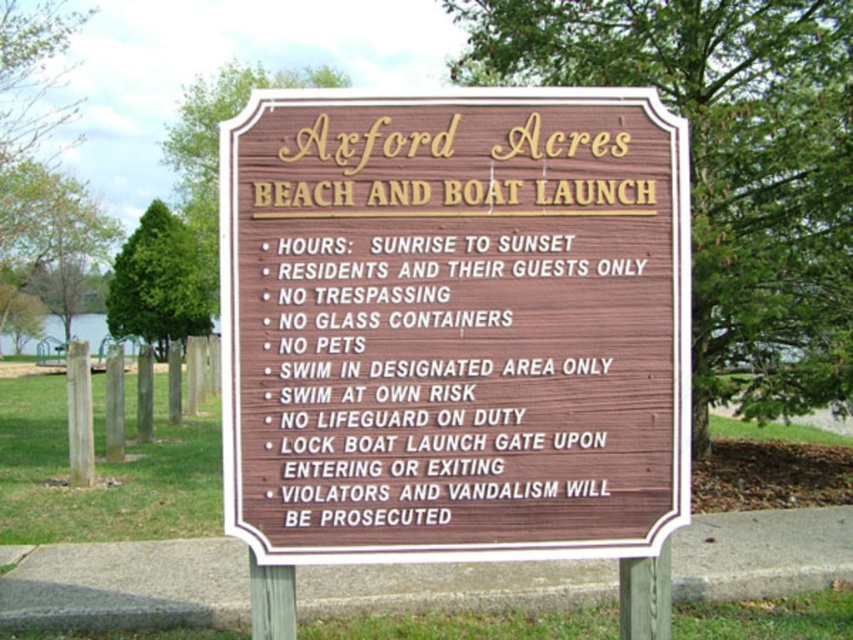
Question: Which point is farther from the camera taking this photo?

Choices:
 (A) (33, 51)
 (B) (556, 113)
 (C) (148, 337)
 (D) (193, 145)

Answer: (C)

Question: Is green leafy tree at upper center wider than green wood tree at left?

Choices:
 (A) yes
 (B) no

Answer: (A)

Question: Considering the relative positions of green leafy tree at upper center and green wood tree at upper center in the image provided, where is green leafy tree at upper center located with respect to green wood tree at upper center?

Choices:
 (A) left
 (B) right

Answer: (B)

Question: Which of the following is the farthest from the observer?

Choices:
 (A) (128, 253)
 (B) (717, 173)
 (C) (625, 163)
 (D) (39, 202)

Answer: (A)

Question: Which of the following is the farthest from the observer?

Choices:
 (A) (817, 397)
 (B) (216, 113)
 (C) (619, 412)

Answer: (B)

Question: Can you confirm if green wood tree at left is bigger than green wood tree at upper center?

Choices:
 (A) yes
 (B) no

Answer: (B)